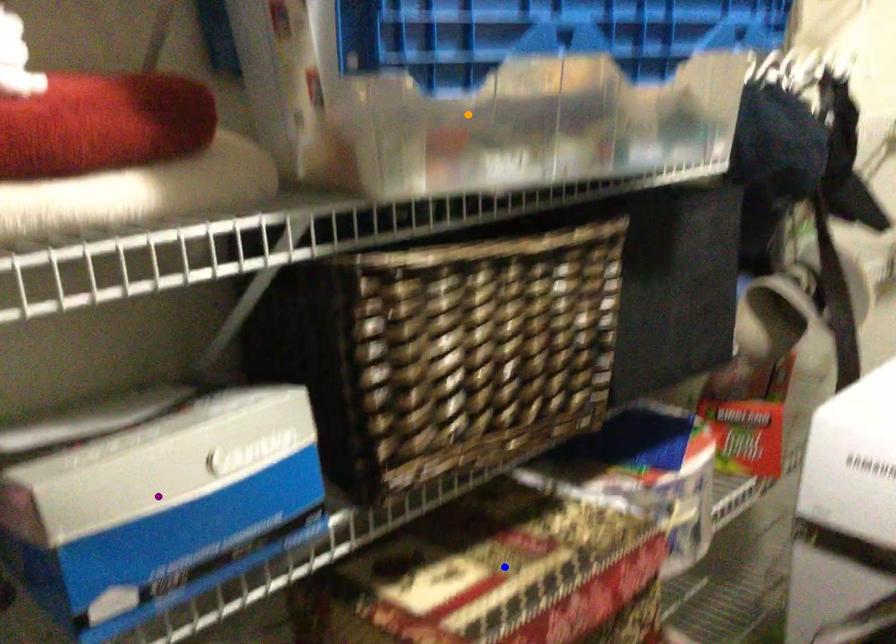
Order these from nearest to farthest:
A) orange point
B) blue point
C) purple point

purple point < orange point < blue point